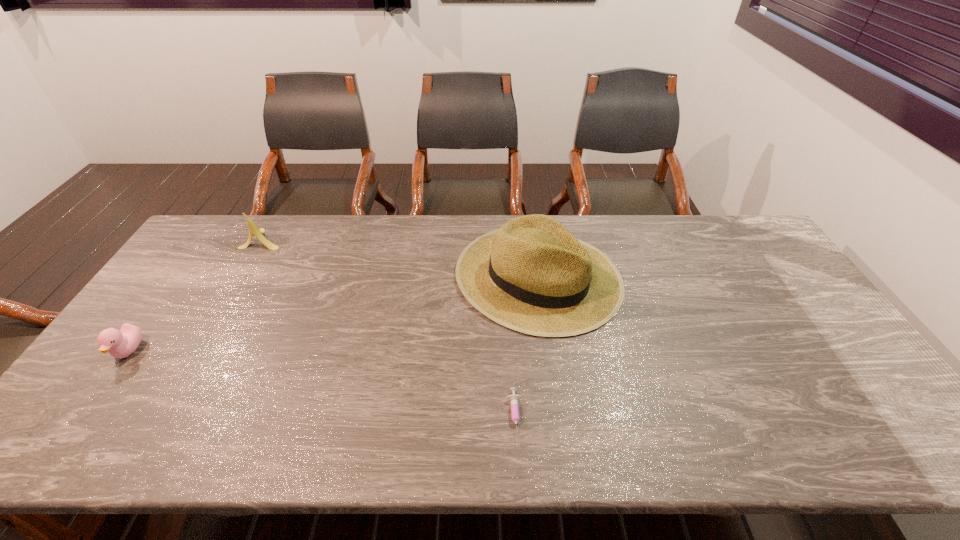
At what (x,y) coordinates should I click in order to perform the action: click on free point between the duckling and the syringe. Please return your answer as a coordinate pair (x, y). The width and height of the screenshot is (960, 540). Looking at the image, I should click on (322, 384).

Locate an element on the screen. vacant region between the sunhat and the banana is located at coordinates (400, 258).

What are the coordinates of `free space between the second shortest object and the third shortest object` in the screenshot? It's located at (196, 295).

This screenshot has width=960, height=540. Find the location of `vacant area that lies between the nearest object and the third shortest object`. vacant area that lies between the nearest object and the third shortest object is located at coordinates point(389,328).

Identify the location of unoccupied position between the leftmost object and the shortest object. (322, 384).

What are the coordinates of `free space between the duckling and the shortest object` in the screenshot? It's located at (322, 384).

Find the location of `empty space that is in between the syringe and the leftmost object`. empty space that is in between the syringe and the leftmost object is located at coordinates (322, 384).

The image size is (960, 540). I want to click on empty location between the duckling and the sunhat, so click(333, 314).

In order to click on vacant region between the syringe and the third shortest object in this screenshot , I will do `click(389, 328)`.

The width and height of the screenshot is (960, 540). What are the coordinates of `free space between the nearest object and the tallest object` in the screenshot? It's located at (527, 347).